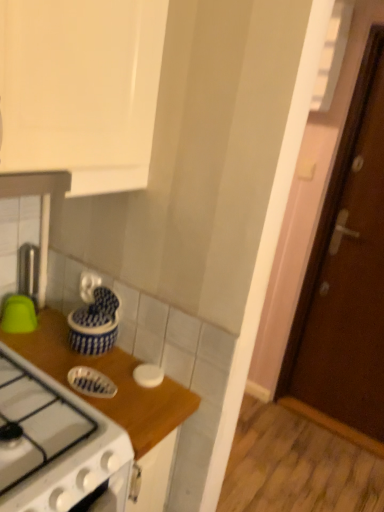
Locate an element on the screen. The height and width of the screenshot is (512, 384). free space between blue glossy dish at center, arranged as the 2th kitchen appliance when viewed from the right, and green matte bowl at left, acting as the fourth kitchen appliance starting from the right is located at coordinates (59, 352).